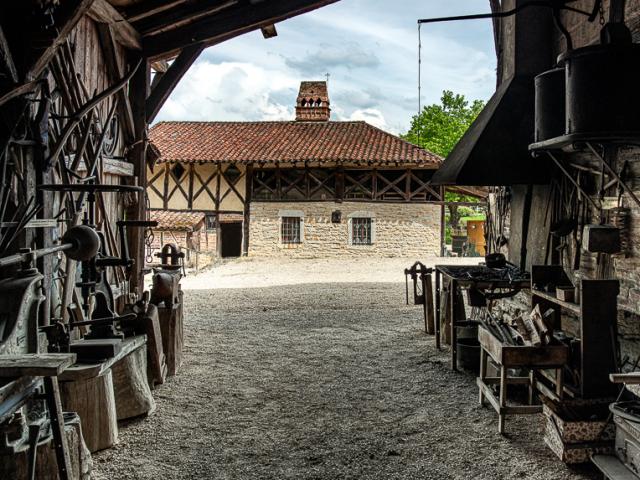
Where is `open door on house`? The height and width of the screenshot is (480, 640). open door on house is located at coordinates (235, 233).